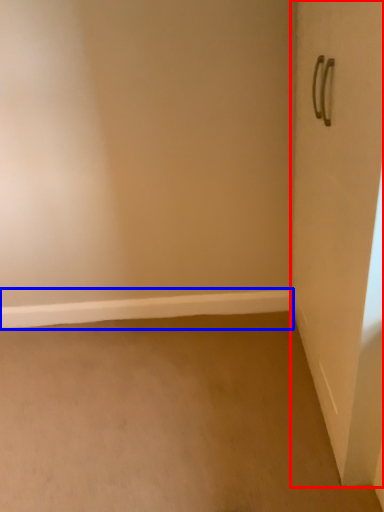
Question: Which object appears closest to the camera in this image, door (highlighted by a red box) or window sill (highlighted by a blue box)?

Choices:
 (A) door
 (B) window sill

Answer: (A)